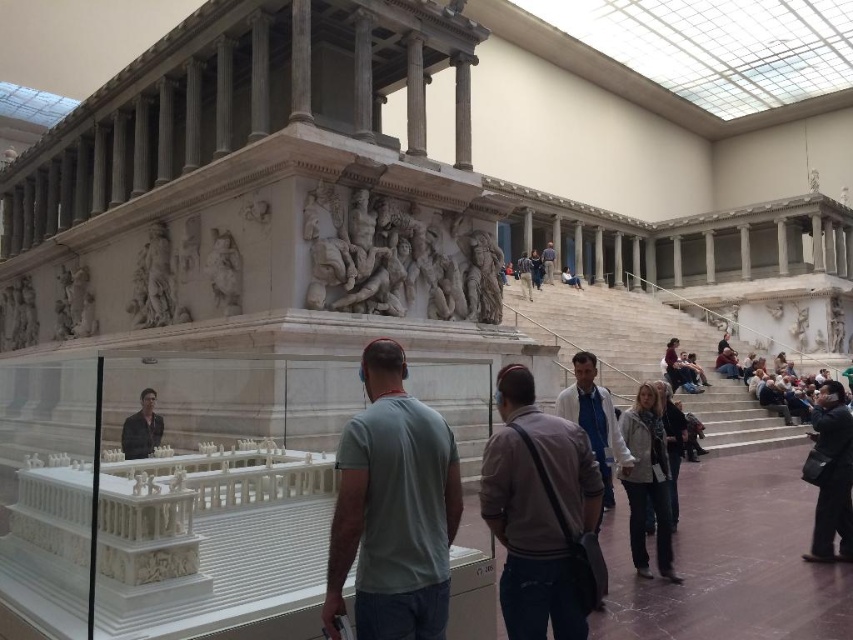
Question: Observing the image, what is the correct spatial positioning of matte gray stone crowd at lower right in reference to blue denim jeans at center?

Choices:
 (A) left
 (B) right

Answer: (B)

Question: Which of the following is the farthest from the observer?

Choices:
 (A) (538, 280)
 (B) (132, 444)
 (C) (390, 483)
 (D) (759, 392)

Answer: (A)

Question: Is gray cotton shirt at center smaller than denim jacket at lower right?

Choices:
 (A) no
 (B) yes

Answer: (B)

Question: Which of the following is the closest to the observer?

Choices:
 (A) black leather jacket at lower right
 (B) denim jacket at lower right
 (C) light gray knit sweater at center
 (D) dark brown leather jacket at lower left

Answer: (D)

Question: Which point is closer to the camera?

Choices:
 (A) black leather jacket at lower right
 (B) matte gray stone crowd at lower right
 (C) light gray knit sweater at center

Answer: (C)

Question: Can you confirm if black leather jacket at lower right is smaller than matte gray stone crowd at lower right?

Choices:
 (A) yes
 (B) no

Answer: (A)